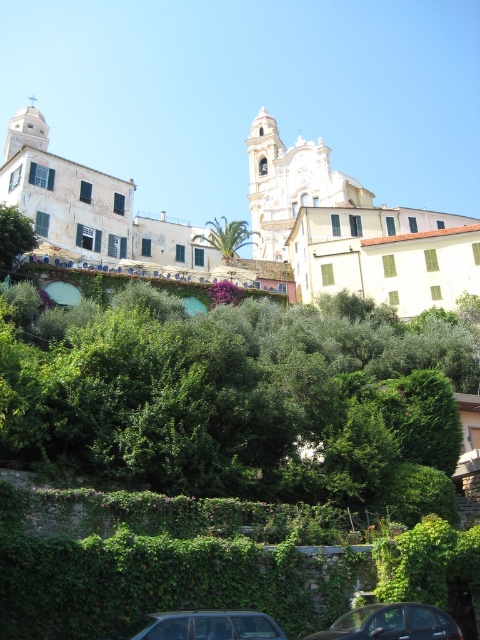
Which of these two, white stone church at upper center or white smooth church at center, stands shorter?

Standing shorter between the two is white smooth church at center.

Which of these two, white stone church at upper center or white smooth church at center, stands taller?

Standing taller between the two is white stone church at upper center.

Between point (52, 180) and point (356, 186), which one is positioned in front?

Point (52, 180)

Identify the location of white stone church at upper center. (348, 228).

Which is more to the left, white stone church at upper center or green leafy palm at center?

From the viewer's perspective, white stone church at upper center appears more on the left side.

Can you confirm if white stone church at upper center is positioned to the left of green leafy palm at center?

Yes, white stone church at upper center is to the left of green leafy palm at center.

Is point (384, 291) positioned in front of point (242, 221)?

Yes.

Where is `white stone church at upper center`? The height and width of the screenshot is (640, 480). white stone church at upper center is located at coordinates (348, 228).

Is shiny black car at lower center wider than green leafy tree at left?

Incorrect, shiny black car at lower center's width does not surpass green leafy tree at left's.

Is shiny black car at lower center taller than green leafy tree at left?

In fact, shiny black car at lower center may be shorter than green leafy tree at left.

Does point (423, 632) come behind point (16, 232)?

No, it is in front of (16, 232).

Where is `shiny black car at lower center`? The width and height of the screenshot is (480, 640). shiny black car at lower center is located at coordinates (392, 624).